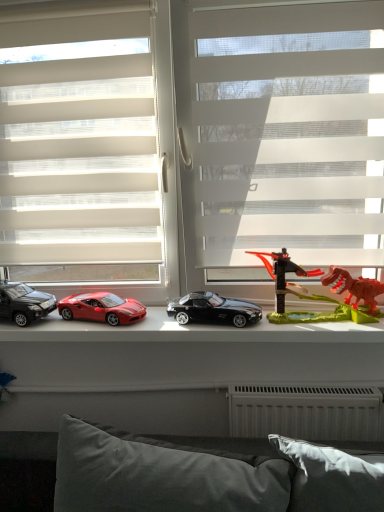
The image size is (384, 512). I want to click on vacant space underneath black metallic car at center, the first car from the right (from a real-world perspective), so pos(213,325).